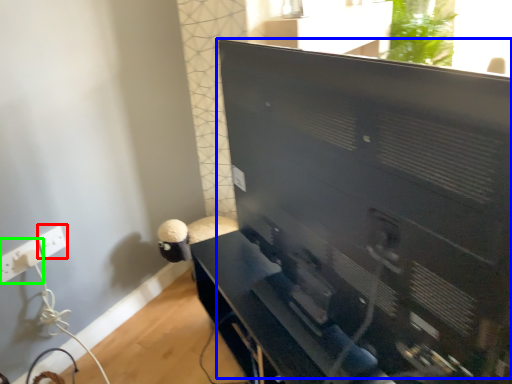
Question: Which is farther away from electric outlet (highlighted by a red box)? computer monitor (highlighted by a blue box) or electric outlet (highlighted by a green box)?

Choices:
 (A) computer monitor
 (B) electric outlet

Answer: (A)